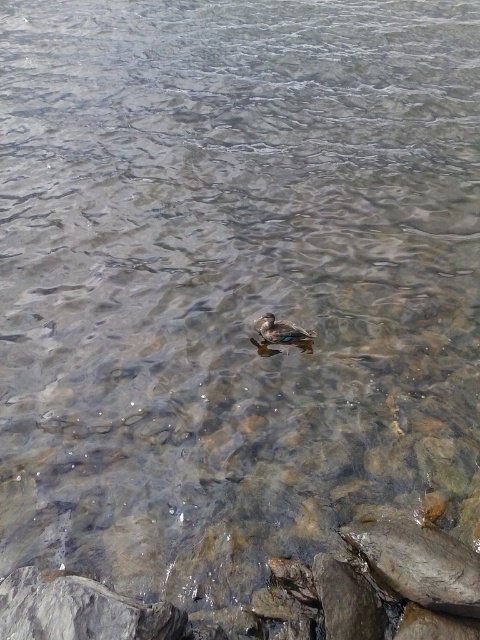
Is gray rough rock at lower left to the right of smooth gray rock at lower right from the viewer's perspective?

In fact, gray rough rock at lower left is to the left of smooth gray rock at lower right.

Is point (14, 598) positioned before point (448, 589)?

No, it is behind (448, 589).

Who is more distant from viewer, (60, 584) or (408, 593)?

Point (60, 584)

You are a GUI agent. You are given a task and a screenshot of the screen. Output one action in this format:
    pyautogui.click(x=<x>, y=<y>)
    Task: Click on the gray rough rock at lower left
    
    Given the screenshot: What is the action you would take?
    pyautogui.click(x=79, y=611)

Based on the photo, is smooth gray rock at lower right thinner than brown matte duck at center?

In fact, smooth gray rock at lower right might be wider than brown matte duck at center.

What do you see at coordinates (420, 563) in the screenshot? This screenshot has height=640, width=480. I see `smooth gray rock at lower right` at bounding box center [420, 563].

Does point (396, 556) lie behind point (288, 330)?

No, (396, 556) is in front of (288, 330).

Where is `smooth gray rock at lower right`? Image resolution: width=480 pixels, height=640 pixels. smooth gray rock at lower right is located at coordinates (420, 563).

Based on the photo, does gray rough rock at lower left have a smaller size compared to brown matte duck at center?

Incorrect, gray rough rock at lower left is not smaller in size than brown matte duck at center.

Which is more to the left, gray rough rock at lower left or brown matte duck at center?

gray rough rock at lower left

Is point (131, 621) more distant than point (280, 332)?

No, it is in front of (280, 332).

Identify the location of gray rough rock at lower left. (79, 611).